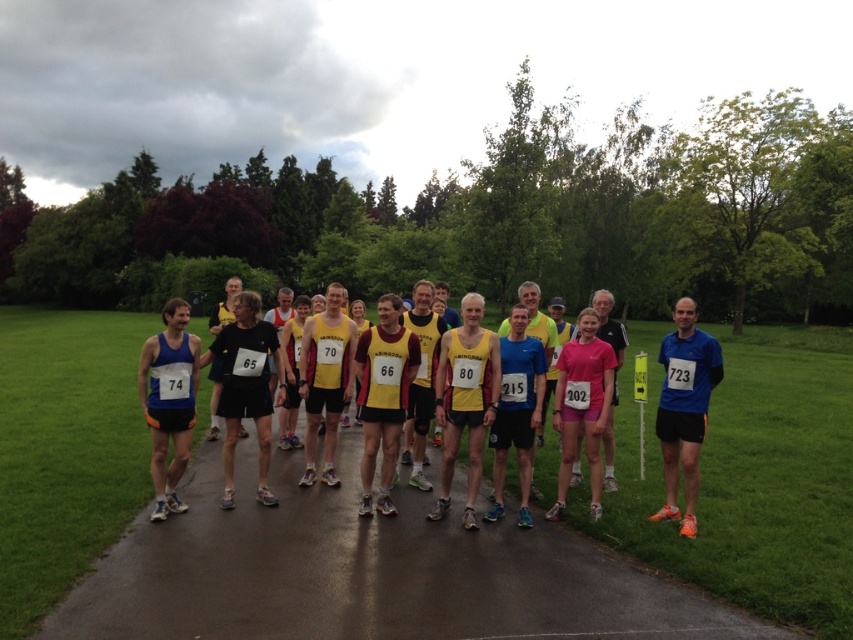
You are a photographer standing at the camera position. You want to capture a photo of the runners such that the point at point (136, 566) is in the center of the frame. Given that your camera has a focal length of 50mm and a sensor size of 24mm x 36mm, will the point be within the frame if you zoom out to 35mm?

The point at point (136, 566) is 15.43 feet away from the camera. Using the formula for field of view, the 35mm lens would provide a wider field of view compared to the 50mm lens, allowing the point to be within the frame.

You are a runner preparing to start a race. You see the black asphalt road at center and the blue fabric running suit at right. Which object is located beneath the other?

The black asphalt road at center is positioned under the blue fabric running suit at right, so the road is beneath the running suit.